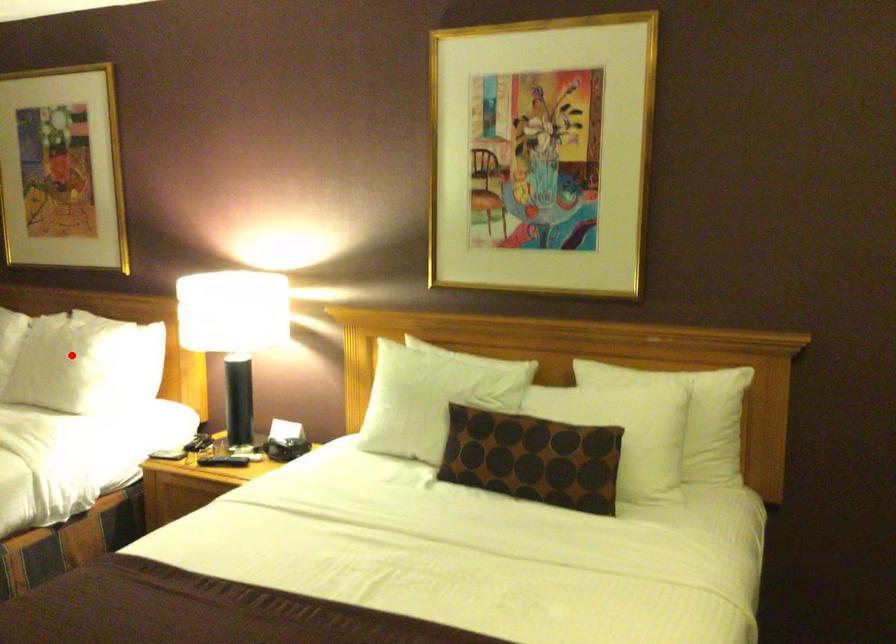
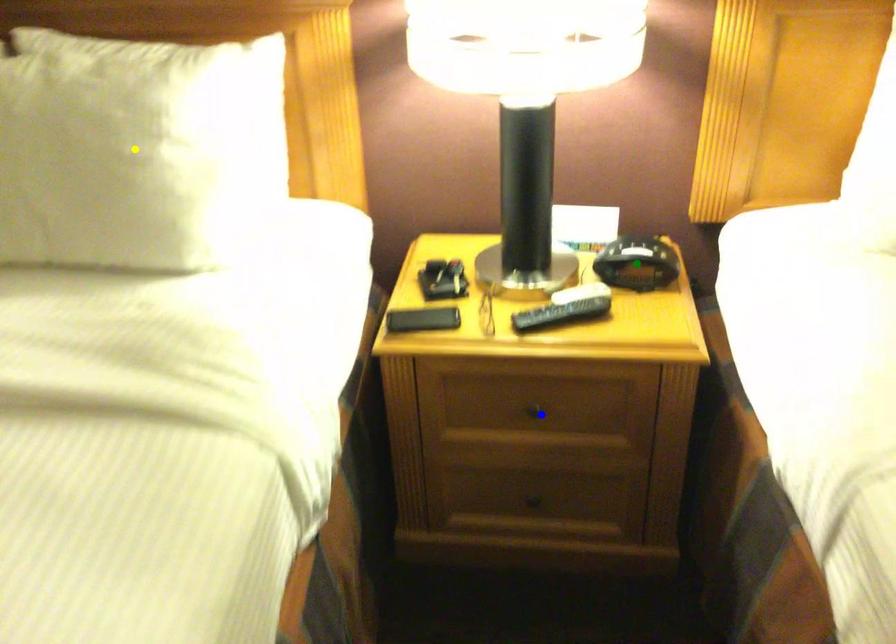
Question: I am providing you with two images of the same scene from different viewpoints. A red point is marked on the first image. You are given multiple points on the second image. In image 2, which mark is for the same physical point as the one in image 1?

Choices:
 (A) green point
 (B) blue point
 (C) yellow point

Answer: (C)